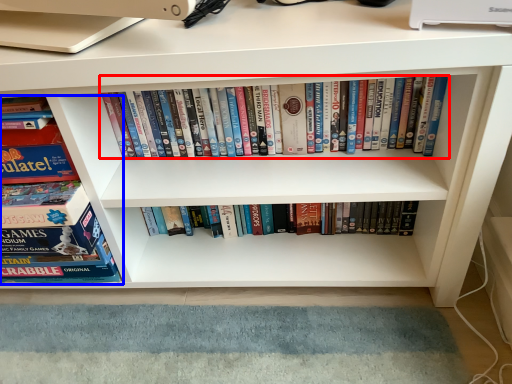
Question: Among these objects, which one is nearest to the camera, book (highlighted by a red box) or book (highlighted by a blue box)?

Choices:
 (A) book
 (B) book

Answer: (B)